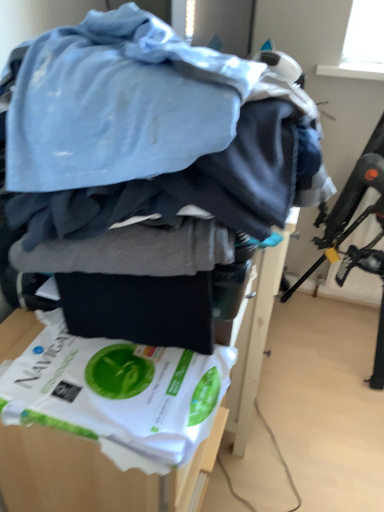
Question: Is white paper bag at center taller than black plastic swivel chair at upper right?

Choices:
 (A) yes
 (B) no

Answer: (B)

Question: Is white paper bag at center further to camera compared to black plastic swivel chair at upper right?

Choices:
 (A) yes
 (B) no

Answer: (B)

Question: From a real-world perspective, is white paper bag at center beneath black plastic swivel chair at upper right?

Choices:
 (A) no
 (B) yes

Answer: (B)

Question: From the image's perspective, does white paper bag at center appear higher than black plastic swivel chair at upper right?

Choices:
 (A) yes
 (B) no

Answer: (B)

Question: Is white paper bag at center smaller than black plastic swivel chair at upper right?

Choices:
 (A) yes
 (B) no

Answer: (A)

Question: Is white paper bag at center not near black plastic swivel chair at upper right?

Choices:
 (A) yes
 (B) no

Answer: (A)

Question: Would you say white paper bag at center is a long distance from white paper at lower left?

Choices:
 (A) no
 (B) yes

Answer: (A)

Question: Does white paper bag at center touch white paper at lower left?

Choices:
 (A) yes
 (B) no

Answer: (B)

Question: From a real-world perspective, is white paper bag at center physically below white paper at lower left?

Choices:
 (A) no
 (B) yes

Answer: (B)

Question: Considering the relative sizes of white paper bag at center and white paper at lower left in the image provided, is white paper bag at center bigger than white paper at lower left?

Choices:
 (A) yes
 (B) no

Answer: (A)

Question: From the image's perspective, is white paper bag at center above white paper at lower left?

Choices:
 (A) no
 (B) yes

Answer: (A)

Question: Is white paper bag at center turned away from white paper at lower left?

Choices:
 (A) no
 (B) yes

Answer: (A)

Question: Is black plastic swivel chair at upper right to the right of white paper at lower left from the viewer's perspective?

Choices:
 (A) yes
 (B) no

Answer: (A)